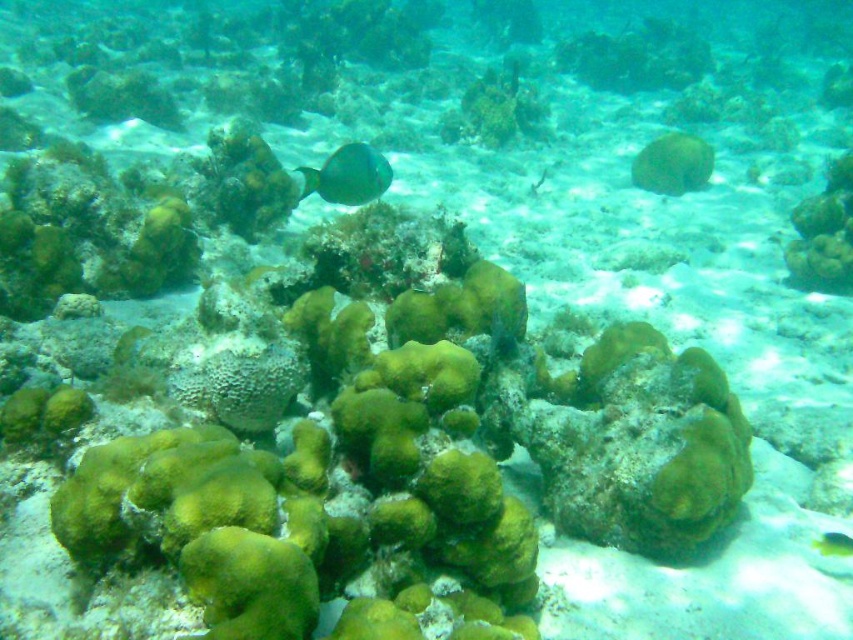
Question: Can you confirm if green matte coral at upper center is bigger than green matte fish at center?

Choices:
 (A) no
 (B) yes

Answer: (B)

Question: Which point is farther from the camera taking this photo?

Choices:
 (A) (822, 532)
 (B) (380, 156)
 (C) (653, 141)

Answer: (C)

Question: Among these objects, which one is nearest to the camera?

Choices:
 (A) green matte coral at upper center
 (B) green matte fish at center
 (C) shiny blue fish at center

Answer: (B)

Question: Which point appears closest to the camera in this image?

Choices:
 (A) (328, 166)
 (B) (834, 536)

Answer: (B)

Question: Does shiny blue fish at center appear under green matte fish at center?

Choices:
 (A) no
 (B) yes

Answer: (A)

Question: Does shiny blue fish at center lie in front of green matte fish at center?

Choices:
 (A) yes
 (B) no

Answer: (B)